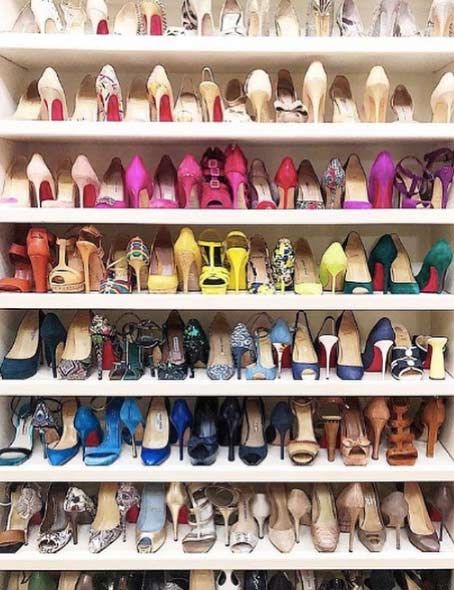
At what (x,y) coordinates should I click in order to perform the action: click on shelf. Please return your answer as a coordinate pair (x, y). Looking at the image, I should click on (228, 47), (229, 129), (226, 218), (232, 304), (228, 389), (219, 476), (225, 557).